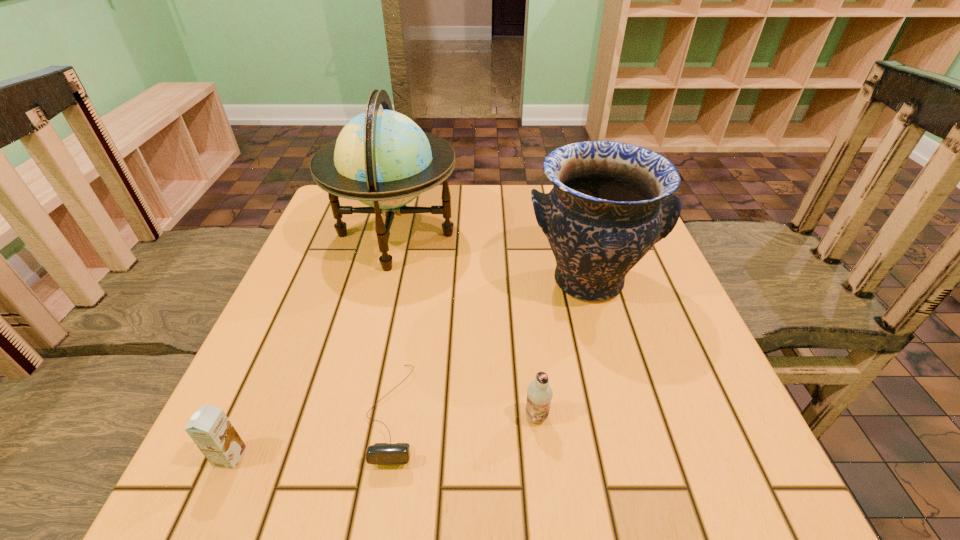
Find the location of a particular element. The height and width of the screenshot is (540, 960). blank region between the globe and the second tallest object is located at coordinates (492, 258).

The height and width of the screenshot is (540, 960). In order to click on free space between the left chocolate milk and the shortest object in this screenshot , I will do `click(312, 435)`.

This screenshot has height=540, width=960. Find the location of `the second closest object to the right chocolate milk`. the second closest object to the right chocolate milk is located at coordinates point(611,202).

Identify which object is the closest to the farther chocolate milk. Please provide its 2D coordinates. Your answer should be formatted as a tuple, i.e. [(x, y)], where the tuple contains the x and y coordinates of a point satisfying the conditions above.

[(380, 453)]

This screenshot has width=960, height=540. Find the location of `vacant area in the image that satisfies the following two spatial constraints: 1. on the back side of the farther chocolate milk; 2. on the right side of the nearer chocolate milk`. vacant area in the image that satisfies the following two spatial constraints: 1. on the back side of the farther chocolate milk; 2. on the right side of the nearer chocolate milk is located at coordinates (248, 417).

Identify the location of vacant space that satisfies the following two spatial constraints: 1. on the front-facing side of the webcam; 2. on the left side of the right chocolate milk. (393, 417).

At what (x,y) coordinates should I click in order to perform the action: click on vacant area in the image that satisfies the following two spatial constraints: 1. on the surface of the tallest object; 2. on the front side of the nearer chocolate milk. Please return your answer as a coordinate pair (x, y). Image resolution: width=960 pixels, height=540 pixels. Looking at the image, I should click on (341, 457).